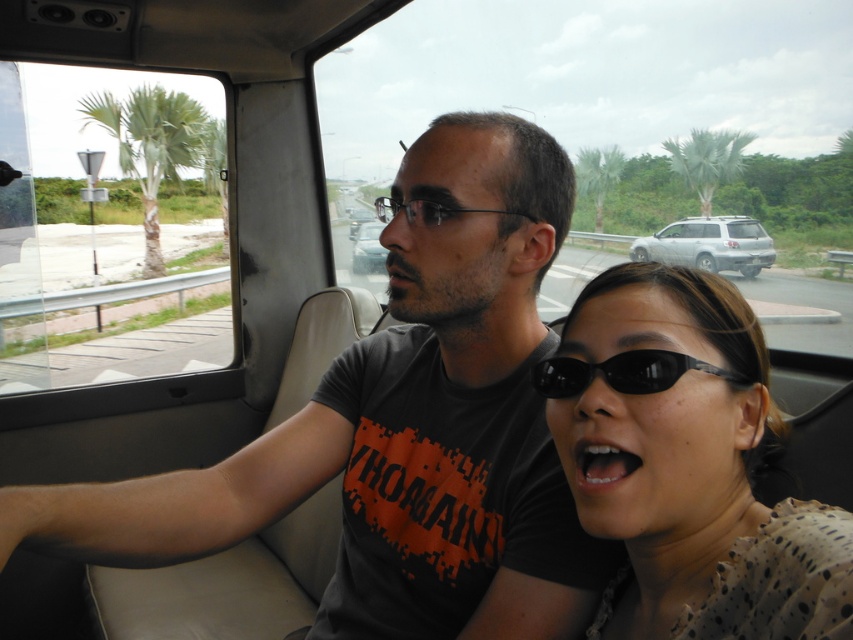
Question: Which point appears closest to the camera in this image?

Choices:
 (A) (712, 154)
 (B) (354, 227)
 (C) (770, 240)

Answer: (B)

Question: Among these objects, which one is nearest to the camera?

Choices:
 (A) dark gray t-shirt at center
 (B) matte black phone at center
 (C) satin silver suv at center
 (D) metallic silver car at center

Answer: (A)

Question: Does matte black sunglasses at center come in front of green leafy palm tree at left?

Choices:
 (A) yes
 (B) no

Answer: (A)

Question: Which object is closer to the camera taking this photo?

Choices:
 (A) black plastic sunglasses at center
 (B) black plastic glasses at center

Answer: (A)

Question: Is green leafy palm tree at left to the right of black plastic sunglasses at center from the viewer's perspective?

Choices:
 (A) yes
 (B) no

Answer: (B)

Question: Is dark gray t-shirt at center positioned in front of matte black sunglasses at center?

Choices:
 (A) yes
 (B) no

Answer: (B)